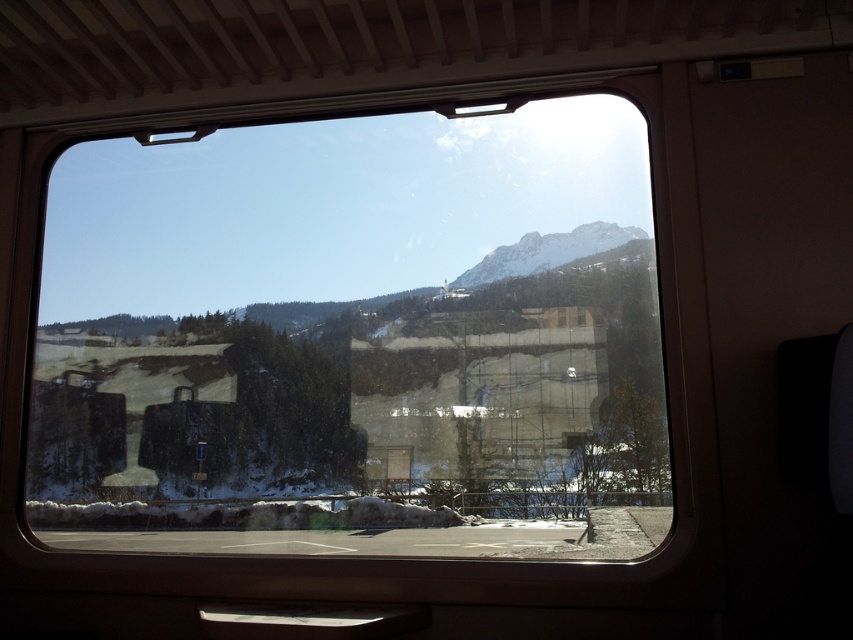
Question: Is transparent glass train window at center smaller than snowy rocky mountain at upper center?

Choices:
 (A) yes
 (B) no

Answer: (B)

Question: Does transparent glass train window at center have a smaller size compared to snowy rocky mountain at upper center?

Choices:
 (A) no
 (B) yes

Answer: (A)

Question: Which point is farther to the camera?

Choices:
 (A) (654, 396)
 (B) (471, 280)

Answer: (B)

Question: Which of the following is the closest to the observer?

Choices:
 (A) (509, 266)
 (B) (648, 220)

Answer: (B)

Question: Which of the following is the closest to the observer?

Choices:
 (A) (490, 269)
 (B) (276, 506)

Answer: (B)

Question: Does transparent glass train window at center have a larger size compared to snowy rocky mountain at upper center?

Choices:
 (A) yes
 (B) no

Answer: (A)